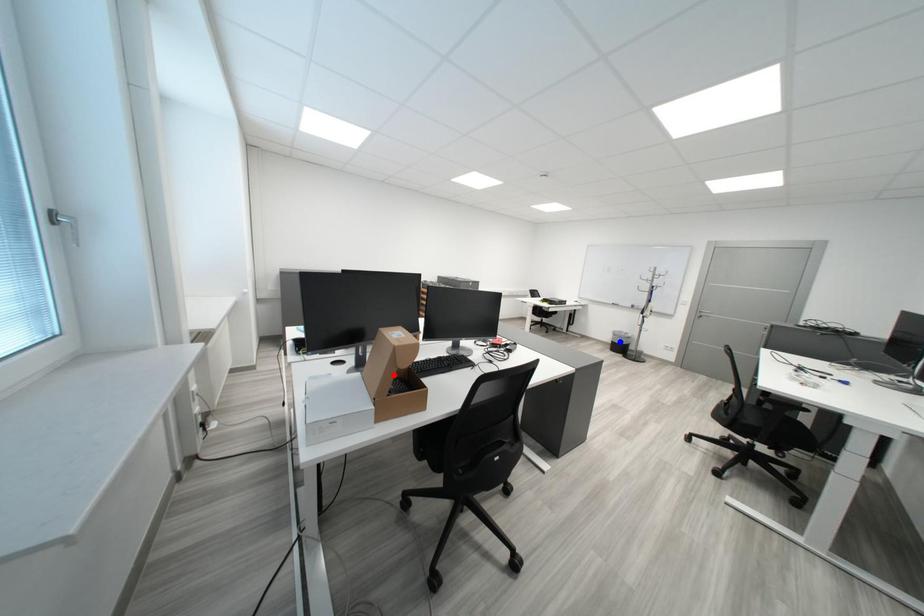
Question: Two points are marked on the image. Which point is closer to the camera?

Choices:
 (A) Blue point is closer.
 (B) Red point is closer.

Answer: (B)